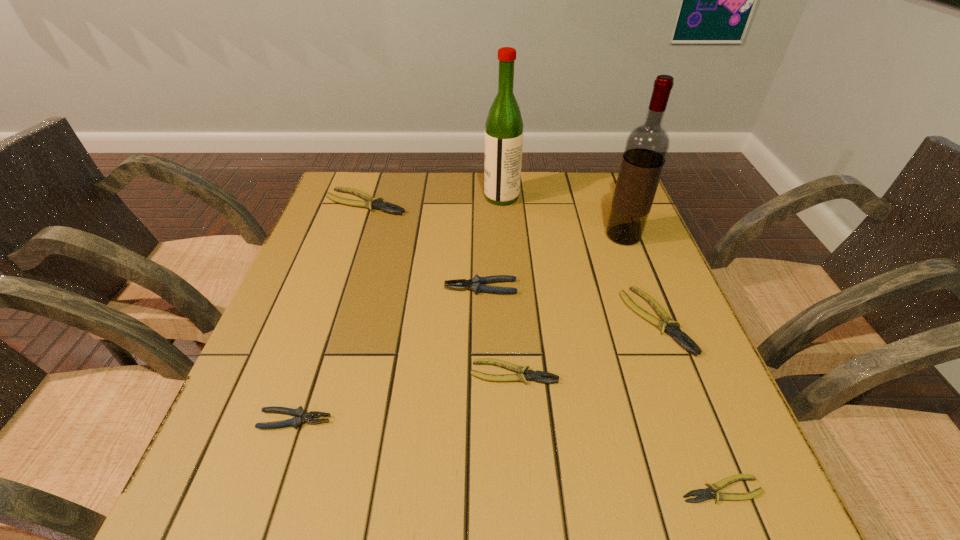
Select which pliers appears as the closest to the third nearest yellow pliers. Please provide its 2D coordinates. Your answer should be formatted as a tuple, i.e. [(x, y)], where the tuple contains the x and y coordinates of a point satisfying the conditions above.

[(531, 375)]

Select which pliers is the second closest to the left gray pliers. Please provide its 2D coordinates. Your answer should be formatted as a tuple, i.e. [(x, y)], where the tuple contains the x and y coordinates of a point satisfying the conditions above.

[(475, 284)]

At what (x,y) coordinates should I click in order to perform the action: click on the third closest yellow pliers to the farthest yellow pliers. Please return your answer as a coordinate pair (x, y). Looking at the image, I should click on (705, 494).

Locate which yellow pliers ranks second in proximity to the farther gray pliers. Please provide its 2D coordinates. Your answer should be formatted as a tuple, i.e. [(x, y)], where the tuple contains the x and y coordinates of a point satisfying the conditions above.

[(667, 324)]

Locate an element on the screen. The height and width of the screenshot is (540, 960). vacant space that satisfies the following two spatial constraints: 1. on the label of the green liquor; 2. on the back side of the third farthest yellow pliers is located at coordinates (513, 373).

Locate an element on the screen. This screenshot has width=960, height=540. free space that satisfies the following two spatial constraints: 1. on the label of the liquor; 2. on the right side of the smallest yellow pliers is located at coordinates (520, 490).

Where is `vacant space that satisfies the following two spatial constraints: 1. at the gripping part of the bigger gray pliers; 2. on the right side of the second shortest pliers`? vacant space that satisfies the following two spatial constraints: 1. at the gripping part of the bigger gray pliers; 2. on the right side of the second shortest pliers is located at coordinates coord(481,373).

What are the coordinates of `vacant region that satisfies the following two spatial constraints: 1. on the back side of the third nearest pliers; 2. at the gripping part of the farther gray pliers` in the screenshot? It's located at (509, 287).

Locate an element on the screen. This screenshot has height=540, width=960. blank space that satisfies the following two spatial constraints: 1. at the gripping part of the shortest object; 2. on the left side of the right gray pliers is located at coordinates (481, 490).

In order to click on vacant point that satisfies the following two spatial constraints: 1. on the front side of the second nearest yellow pliers; 2. on the right side of the shortest object in this screenshot , I will do `click(522, 490)`.